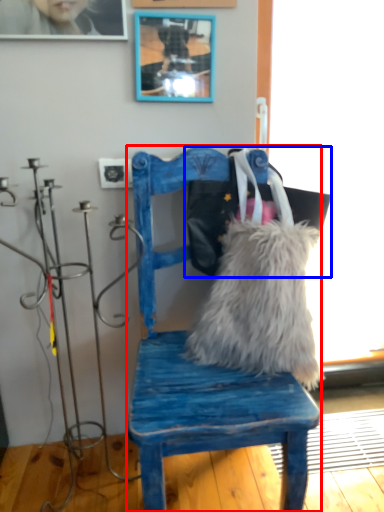
Question: Which object is further to the camera taking this photo, chair (highlighted by a red box) or messenger bag (highlighted by a blue box)?

Choices:
 (A) chair
 (B) messenger bag

Answer: (B)